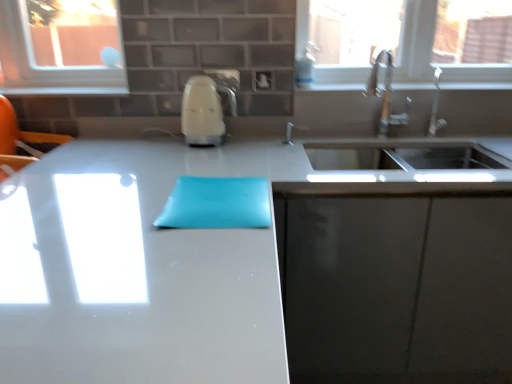
Identify the location of vacant area that is situated to the right of satin nickel faucet at upper right. (469, 133).